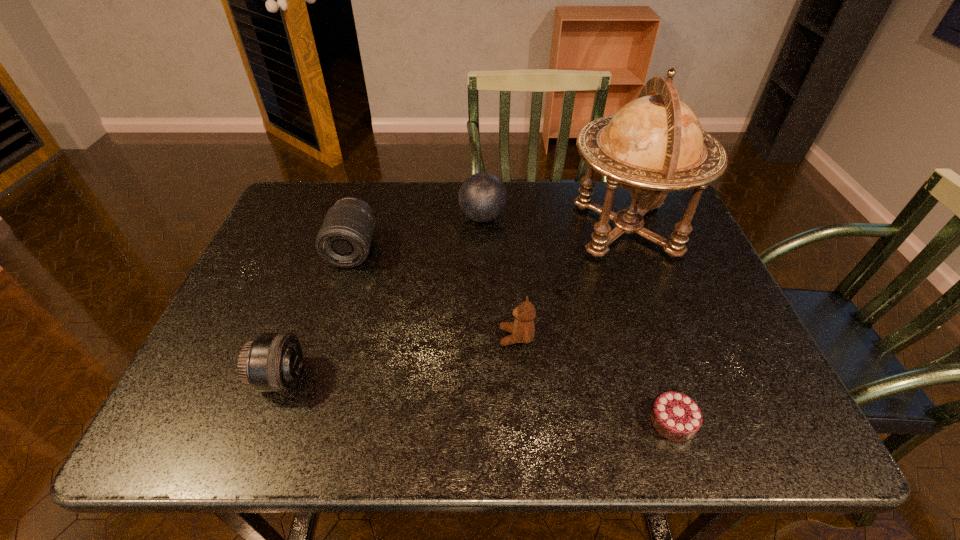
Where is `free region located 0.360m on the grip area of the bowling ball`? This screenshot has height=540, width=960. free region located 0.360m on the grip area of the bowling ball is located at coordinates (336, 217).

Image resolution: width=960 pixels, height=540 pixels. In order to click on vacant region located on the grip area of the bowling ball in this screenshot , I will do `click(322, 217)`.

Identify the location of free space located on the surface of the farther telephoto lens. (342, 287).

This screenshot has width=960, height=540. Identify the location of free location located 0.350m at the face of the fourth farthest object. (342, 337).

The height and width of the screenshot is (540, 960). What are the coordinates of `vacant space located at the face of the fourth farthest object` in the screenshot? It's located at (338, 337).

Image resolution: width=960 pixels, height=540 pixels. I want to click on vacant area situated 0.370m at the face of the fourth farthest object, so click(333, 337).

The height and width of the screenshot is (540, 960). I want to click on vacant region located 0.330m on the front-facing side of the nearer telephoto lens, so click(465, 378).

You are a GUI agent. You are given a task and a screenshot of the screen. Output one action in this format:
    pyautogui.click(x=<x>, y=<y>)
    Task: Click on the vacant space located on the right of the shortest object
    This screenshot has height=540, width=960.
    Given the screenshot: What is the action you would take?
    pyautogui.click(x=727, y=421)

Find the location of a particular element. The image size is (960, 540). globe that is at the far edge is located at coordinates (654, 144).

This screenshot has height=540, width=960. In order to click on bowling ball located in the far edge section of the desktop in this screenshot , I will do `click(482, 197)`.